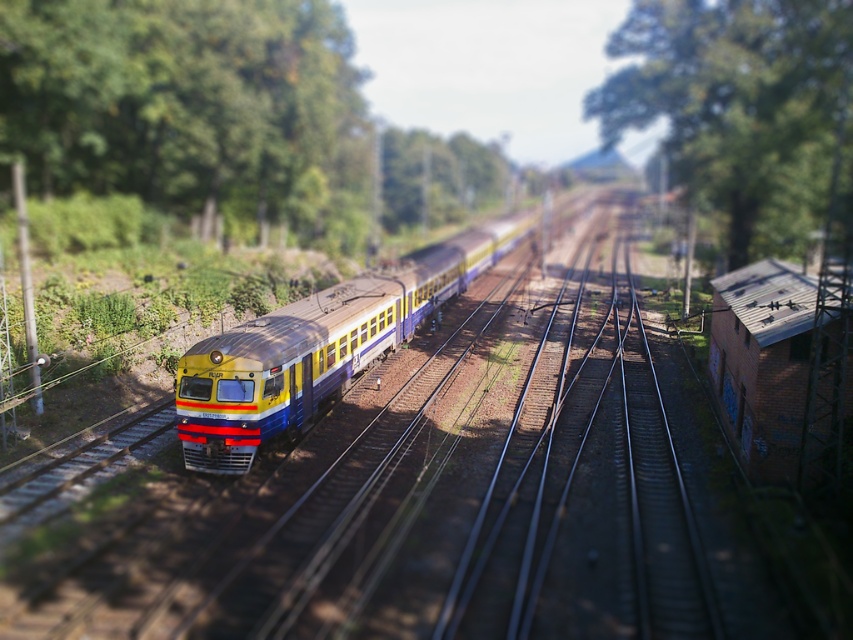
You are a model railway enthusiast observing the scene. You notice a point marked at coordinates (190, 108). What object is located at this coordinate?

The point at coordinates (190, 108) corresponds to a green leafy tree at upper left.

You are a passenger on the train in the model railway scene. Looking out the window, you notice two green leafy trees in the upper part of your view. Which tree, the green leafy tree at upper left or the green leafy tree at upper center, is closer to you?

The green leafy tree at upper left is closer to you because the green leafy tree at upper center is positioned behind it.

You are a model train enthusiast observing the scene. You notice the green leafy tree at upper left and the yellow matte train at center. Which object is positioned to the left of the other?

The green leafy tree at upper left is to the left of the yellow matte train at center.